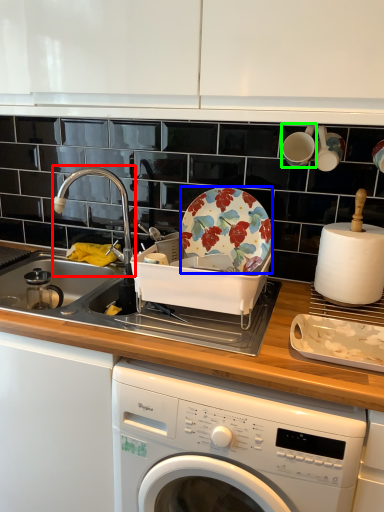
Question: Considering the real-world distances, which object is closest to tap (highlighted by a red box)? plate (highlighted by a blue box) or tableware (highlighted by a green box).

Choices:
 (A) plate
 (B) tableware

Answer: (A)